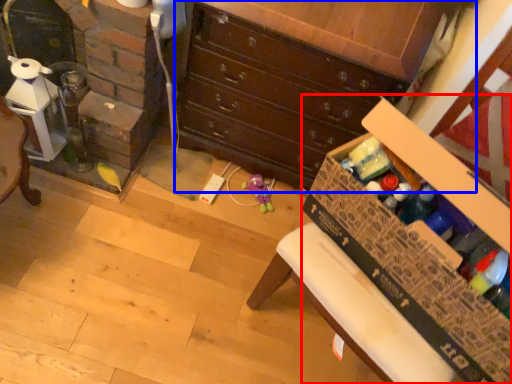
Question: Among these objects, which one is farthest to the camera, cardboard box (highlighted by a red box) or chest of drawers (highlighted by a blue box)?

Choices:
 (A) cardboard box
 (B) chest of drawers

Answer: (B)